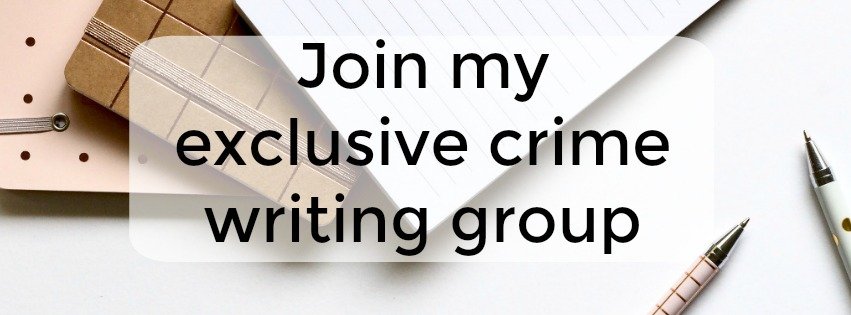
Where is `brown notebook`? This screenshot has height=315, width=851. brown notebook is located at coordinates (134, 29).